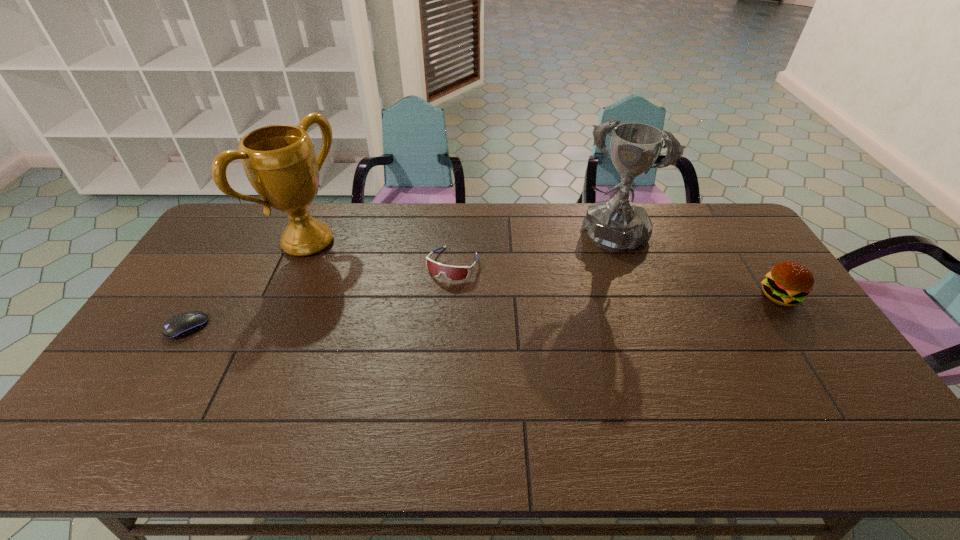
Find the location of a particular element. The image size is (960, 540). vacant space located 0.350m on the side with emblem of the right award is located at coordinates (556, 323).

Where is `vacant space located 0.350m on the side with emblem of the right award`? vacant space located 0.350m on the side with emblem of the right award is located at coordinates (556, 323).

Find the location of `free space located on the side with emblem of the right award`. free space located on the side with emblem of the right award is located at coordinates (589, 267).

This screenshot has height=540, width=960. Find the location of `vacant space located on the front-facing side of the goggles`. vacant space located on the front-facing side of the goggles is located at coordinates (401, 355).

In order to click on free space located on the front-facing side of the goggles in this screenshot , I will do `click(424, 313)`.

Identify the location of vacant area located 0.160m on the front-facing side of the goggles. This screenshot has height=540, width=960. (422, 318).

This screenshot has height=540, width=960. I want to click on vacant position located on the front of the left award with the decoration, so click(x=387, y=293).

Locate an element on the screen. The width and height of the screenshot is (960, 540). vacant point located 0.310m on the front of the left award with the decoration is located at coordinates (398, 299).

At what (x,y) coordinates should I click in order to perform the action: click on vacant space situated on the front of the left award with the decoration. Please return your answer as a coordinate pair (x, y). Looking at the image, I should click on (348, 271).

In order to click on object situated at the left edge in this screenshot , I will do `click(181, 325)`.